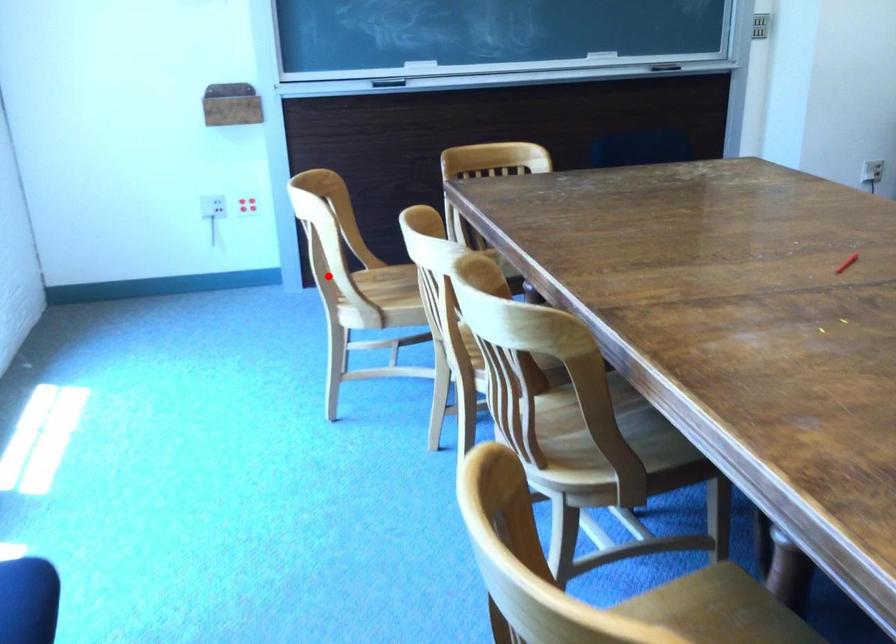
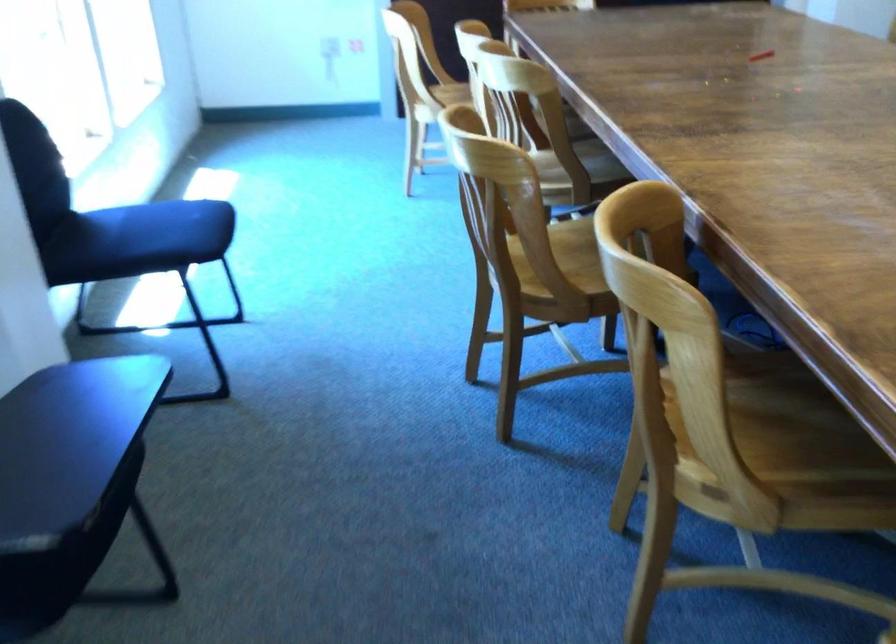
Question: I am providing you with two images of the same scene from different viewpoints. A red point is marked on the first image. Can you still see the location of the red point in image 2?

Choices:
 (A) Yes
 (B) No

Answer: (B)